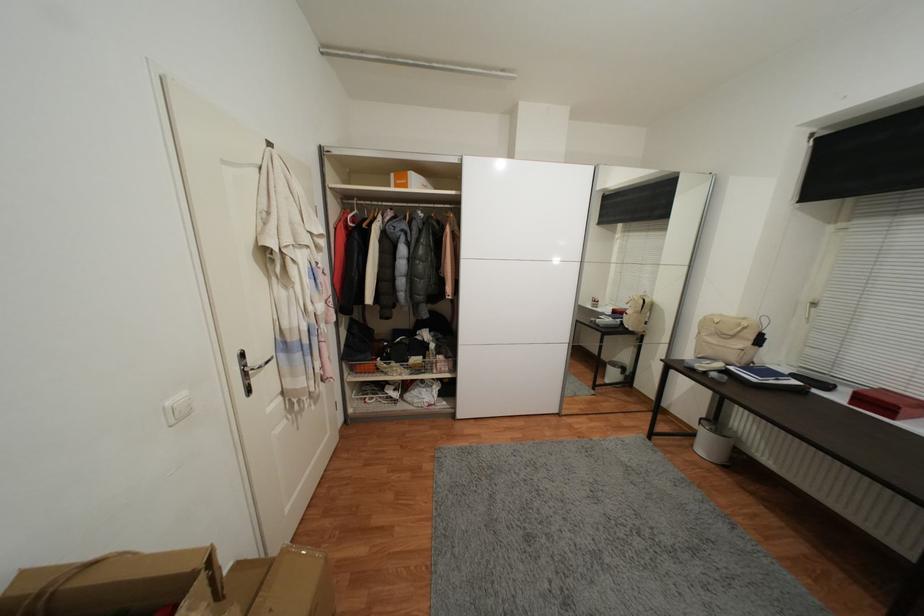
Where is `red box`? The image size is (924, 616). red box is located at coordinates (886, 403).